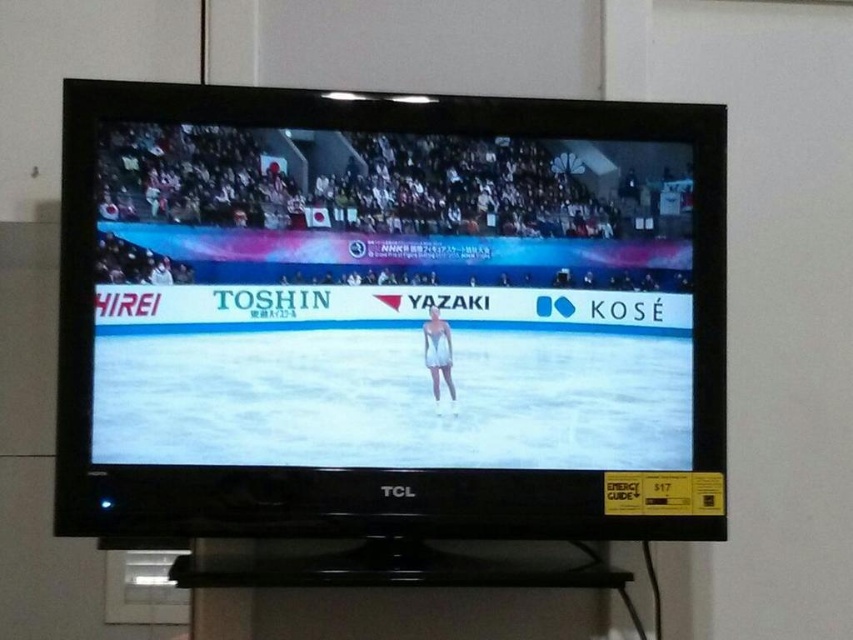
What are the coordinates of the matte white figure skater at center?

The coordinates of the matte white figure skater at center are at point (390, 300).

You are an athlete preparing to watch a figure skating performance on the television. You notice the matte white figure skater at center and the white matte swimsuit at center on the screen. Which object appears wider on the TV screen?

The matte white figure skater at center appears wider than the white matte swimsuit at center because the figure skater has a greater width according to the description.